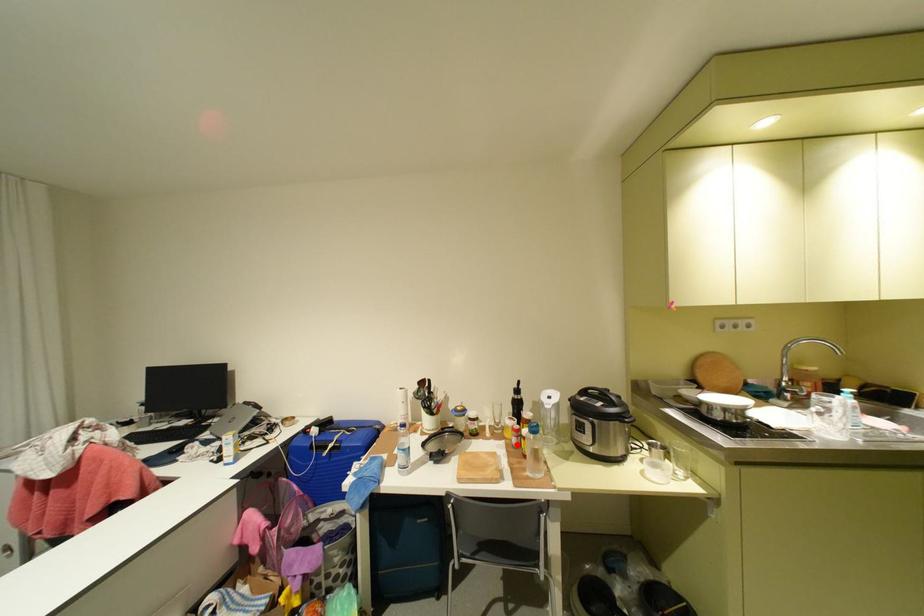
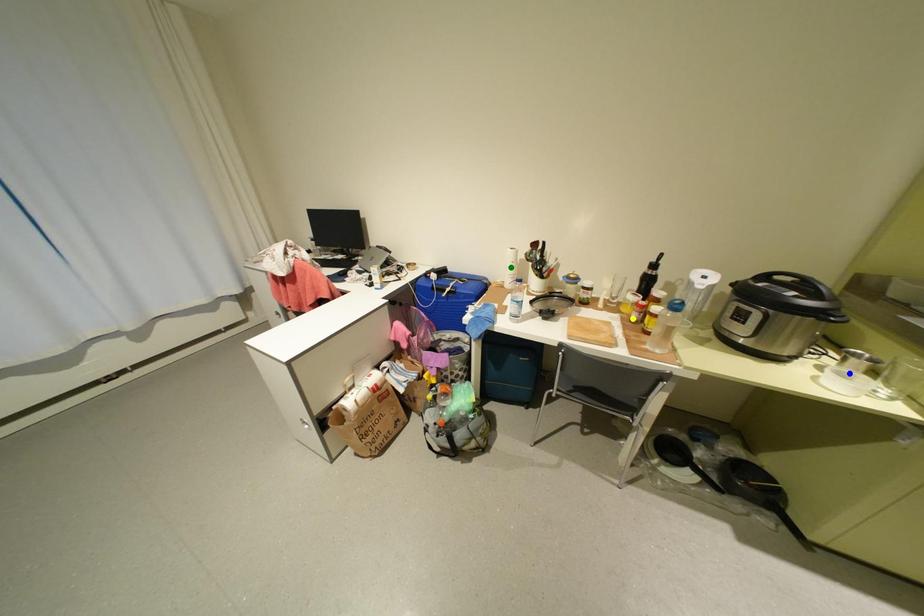
Question: I am providing you with two images of the same scene from different viewpoints. A red point is marked on the first image. You are given multiple points on the second image. In image 2, which mark is for the same physical point as the one in image 1?

Choices:
 (A) green point
 (B) yellow point
 (C) blue point

Answer: (B)